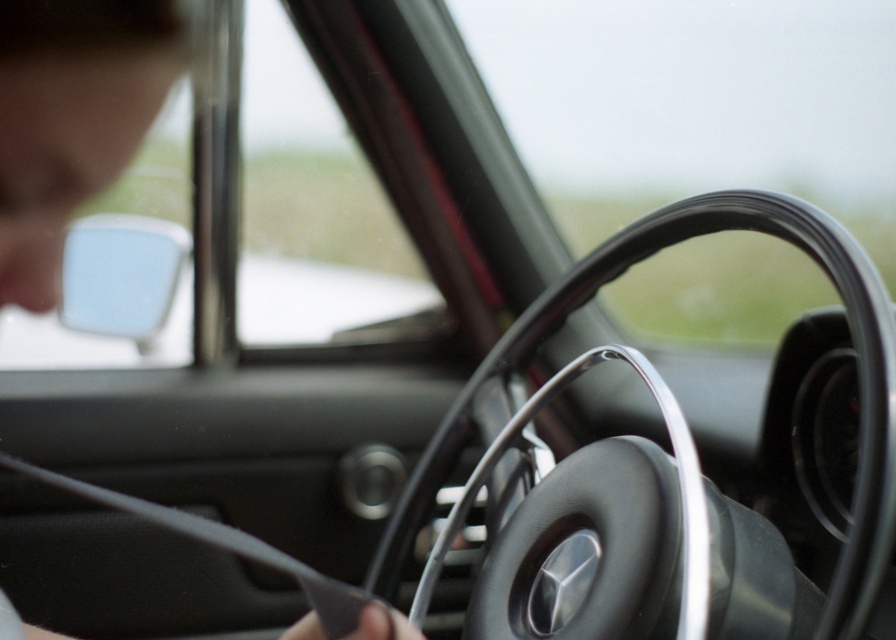
Is point (159, 90) closer to viewer compared to point (751, 216)?

That is True.

Find the location of a particular element. Image resolution: width=896 pixels, height=640 pixels. matte black hair at upper left is located at coordinates (70, 120).